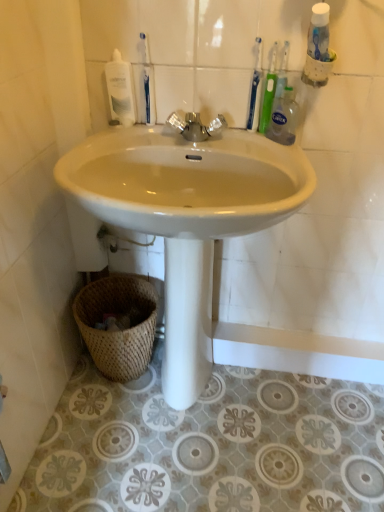
This screenshot has width=384, height=512. In order to click on free space on the front side of blue plastic toothbrush at upper right, acting as the second toothbrush starting from the right in this screenshot , I will do `click(261, 149)`.